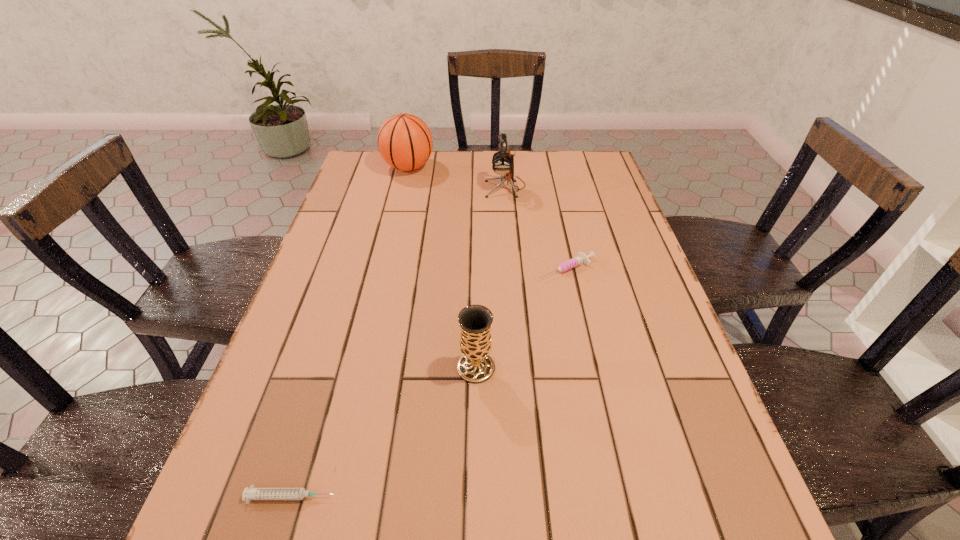
Where is `vacant space located 0.250m on the left of the second nearest object`? vacant space located 0.250m on the left of the second nearest object is located at coordinates pos(335,368).

At what (x,y) coordinates should I click in order to perform the action: click on vacant space situated 0.270m on the left of the third farthest object. Please return your answer as a coordinate pair (x, y). Looking at the image, I should click on (430, 269).

Identify the location of vacant space positioned at the needle end of the nearer syringe. (402, 497).

I want to click on earphone situated at the far edge, so click(502, 162).

Find the location of `basketball positioned at the far edge`. basketball positioned at the far edge is located at coordinates (405, 142).

The height and width of the screenshot is (540, 960). Identify the location of basketball that is at the left edge. (x=405, y=142).

At what (x,y) coordinates should I click in order to perform the action: click on syringe at the left edge. Please return your answer as a coordinate pair (x, y). The image size is (960, 540). Looking at the image, I should click on (251, 493).

Where is `object that is at the right edge`? This screenshot has width=960, height=540. object that is at the right edge is located at coordinates (581, 258).

The width and height of the screenshot is (960, 540). In order to click on object present at the far left corner in this screenshot , I will do `click(405, 142)`.

You are a GUI agent. You are given a task and a screenshot of the screen. Output one action in this format:
    pyautogui.click(x=<x>, y=<y>)
    Task: Click on the blank area at the far edge
    The image size is (960, 540).
    Given the screenshot: What is the action you would take?
    pyautogui.click(x=426, y=176)